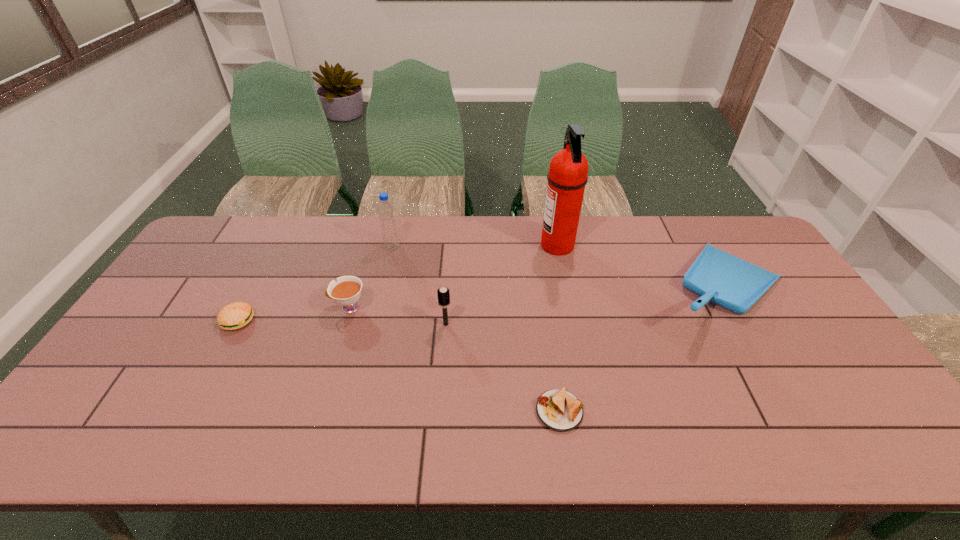
Image resolution: width=960 pixels, height=540 pixels. What are the coordinates of `vacant area between the patty and the tallest object` in the screenshot? It's located at (397, 283).

Where is `vacant space in between the leftmost object and the shortest object`? vacant space in between the leftmost object and the shortest object is located at coordinates (398, 366).

Identify which object is the fifth nearest to the tallest object. Please provide its 2D coordinates. Your answer should be formatted as a tuple, i.e. [(x, y)], where the tuple contains the x and y coordinates of a point satisfying the conditions above.

[(346, 291)]

Find the location of a particular element. The image size is (960, 540). object identified as the sixth closest to the tallest object is located at coordinates (233, 316).

Identify the location of free space that satisfies the following two spatial constraints: 1. on the side of the dustpan near the handle; 2. on the right side of the fire extinguisher. (566, 288).

Where is `vacant space that satisfies the following two spatial constraints: 1. on the back side of the fourth object from right to left; 2. on the right side of the rightmost object`? This screenshot has width=960, height=540. vacant space that satisfies the following two spatial constraints: 1. on the back side of the fourth object from right to left; 2. on the right side of the rightmost object is located at coordinates (448, 288).

Find the location of a particular element. The height and width of the screenshot is (540, 960). vacant region that satisfies the following two spatial constraints: 1. on the front side of the shortest object; 2. on the right side of the leftmost object is located at coordinates (190, 411).

Find the location of `vacant area that satisfies the following two spatial constraints: 1. on the side of the fire extinguisher near the handle; 2. on the left side of the dustpan`. vacant area that satisfies the following two spatial constraints: 1. on the side of the fire extinguisher near the handle; 2. on the left side of the dustpan is located at coordinates (566, 288).

The image size is (960, 540). What are the coordinates of `vacant space that satisfies the following two spatial constraints: 1. on the side of the third shortest object with the handle; 2. on the front side of the sixth tallest object` in the screenshot? It's located at (345, 321).